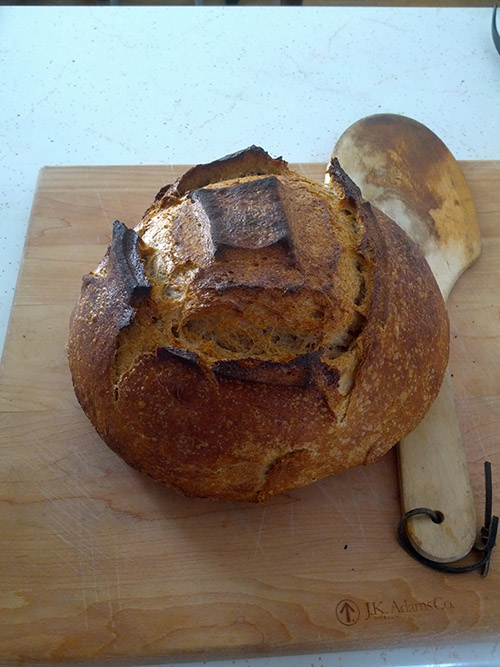
Identify the location of spoon handle. This screenshot has height=667, width=500. (437, 469).